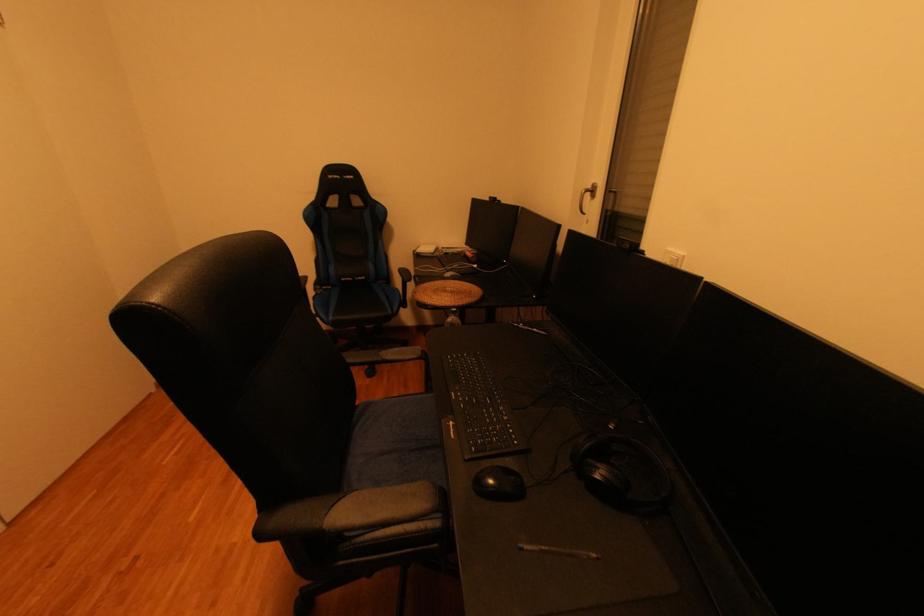
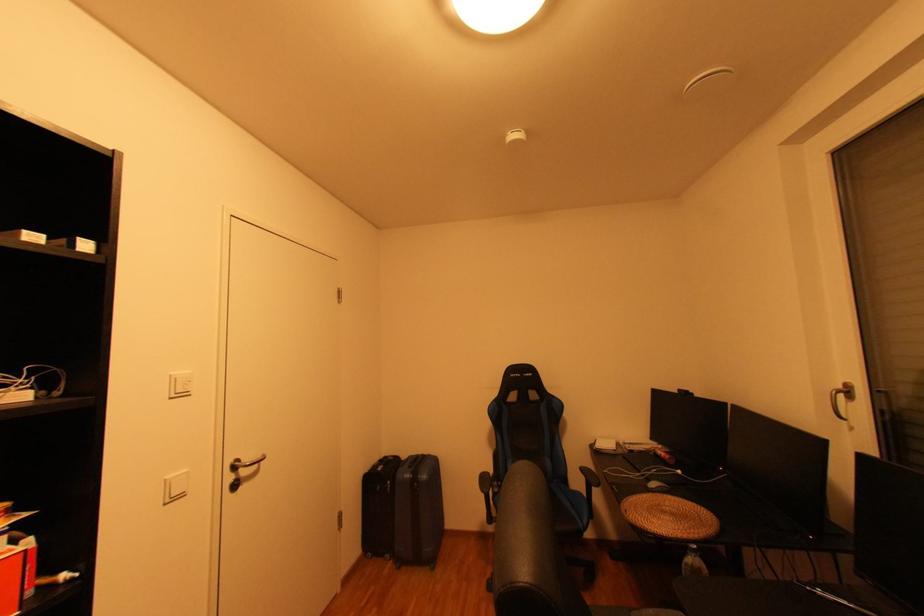
The point at [428,252] is marked in the first image. Where is the corresponding point in the second image?

(606, 448)